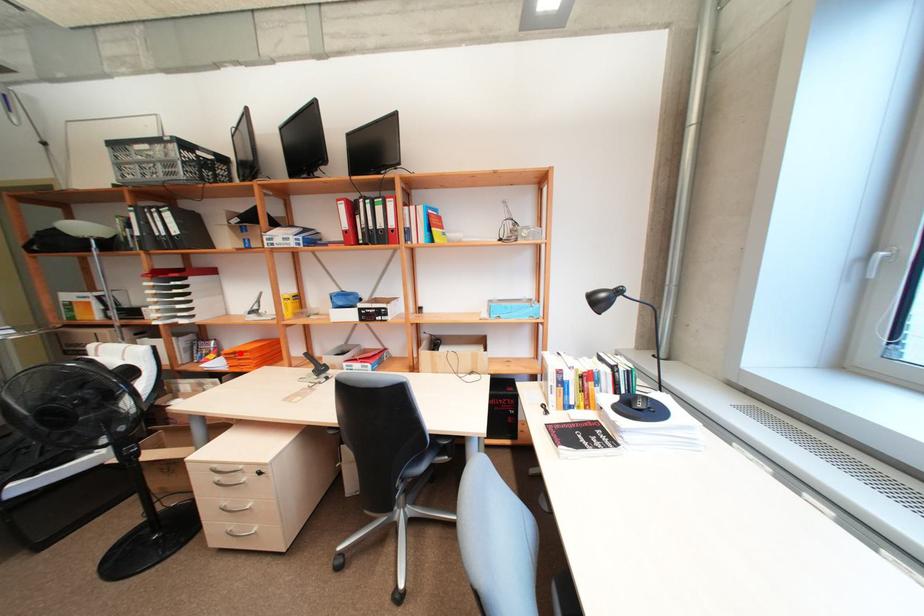
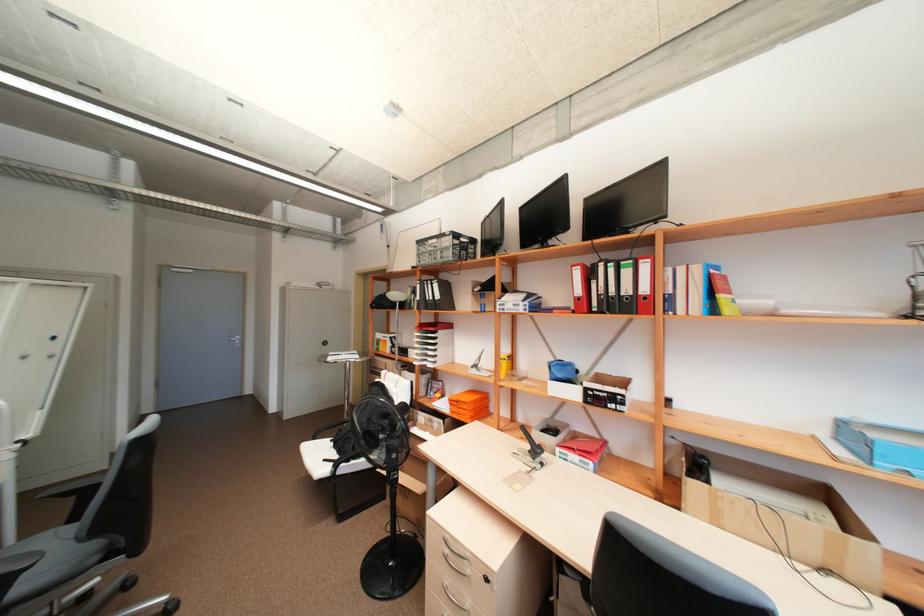
Question: I am providing you with two images of the same scene from different viewpoints. Image1 has a red point marked. In image2, the corresponding 3D location appears at what relative position? Reply with the corresponding letter.

Choices:
 (A) Closer
 (B) Farther

Answer: (B)